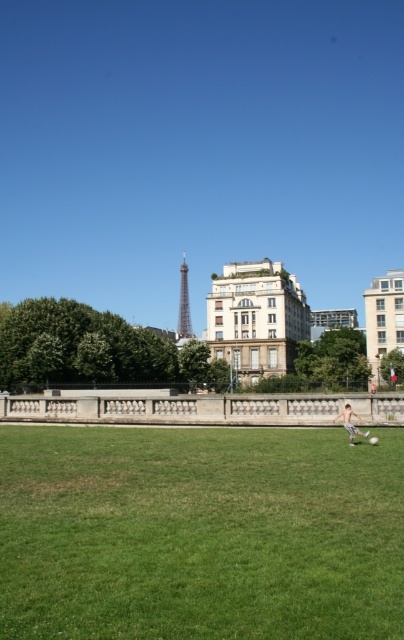
Is green grass at lower center smaller than metallic silver tower at center?

Yes.

Find the location of a particular element. The height and width of the screenshot is (640, 404). green grass at lower center is located at coordinates (199, 532).

Which is in front, point (389, 596) or point (355, 412)?

Point (389, 596) is in front.

Is point (294, 624) positioned before point (349, 410)?

Yes, it is.

Is point (260, 541) positioned behind point (351, 426)?

That is False.

This screenshot has height=640, width=404. Identify the location of green grass at lower center. (199, 532).

Does white concrete building at right have a lesser height compared to skinny white boy at lower right?

No.

Which is in front, point (401, 291) or point (351, 432)?

Positioned in front is point (351, 432).

Is point (366, 321) behind point (359, 419)?

Yes.

Locate an element on the screen. white concrete building at right is located at coordinates (383, 317).